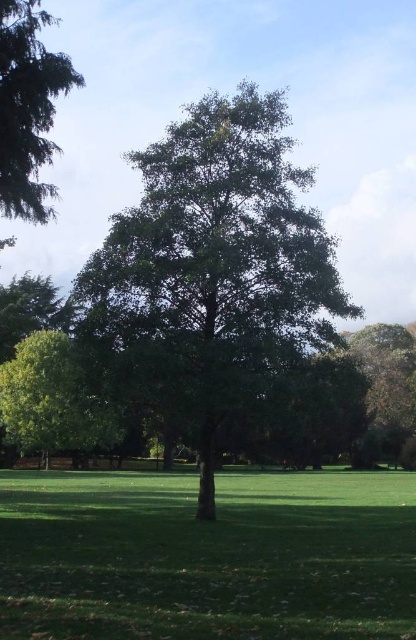
You are a gardener who needs to mow the lawn. You see the green grass at center and the green leafy tree at right. Which one is shorter?

The green grass at center is shorter than the green leafy tree at right.

You are a gardener planning to plant a new flower bed in the park. You have two options for locations based on the image provided. The first option is near the green grass at center, and the second is near the green leafy tree at center. Considering the spatial relationship between these two areas, which location would you choose for the flower bed to ensure it receives adequate sunlight, and why?

The green grass at center is positioned under the green leafy tree at center, which means planting the flower bed there might result in insufficient sunlight due to the tree canopy blocking light. Therefore, the better choice would be near the green leafy tree at center, but outside its direct shadow area, ensuring the flowers receive enough sunlight while still benefiting from the tree for shade during peak heat.

You are standing in the park and want to take a photo of the green leafy tree at center. However, you notice another green leafy tree at lower left in the background. Which tree is closer to you?

The green leafy tree at center is closer to you because it is in front of the green leafy tree at lower left.